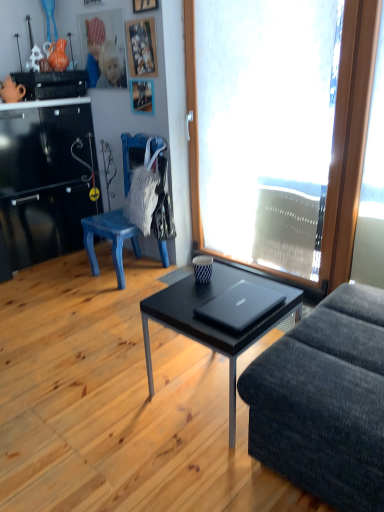
The width and height of the screenshot is (384, 512). In order to click on vacant space that's between blue and white ceramic cup at center and black matte laptop at center in this screenshot , I will do `click(211, 290)`.